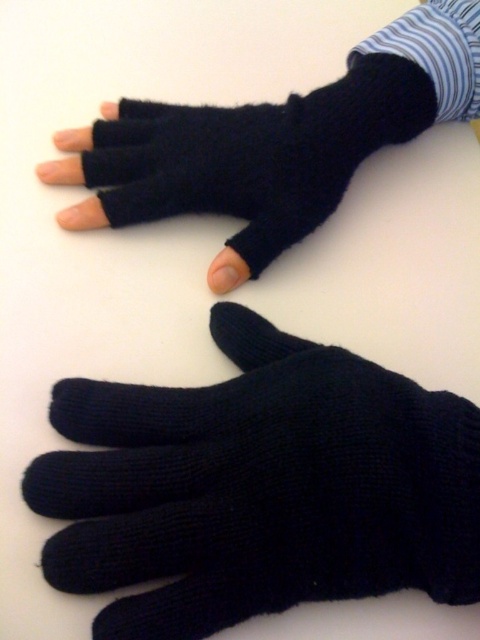
You are trying to decide which glove to wear for a cold day. Both the black knitted glove at center and the black knitted fingerless glove at upper center are available. Which one would provide more hand coverage?

The black knitted glove at center is much taller than the black knitted fingerless glove at upper center, so it provides more hand coverage.

You are a delivery robot that needs to place a package between the black knitted glove at center and the black knitted fingerless glove at upper center. The package requires at least 15 inches of space to be placed safely. Can you fit the package between them?

The black knitted glove at center and black knitted fingerless glove at upper center are 14.49 inches apart, which is less than the required 15 inches. Therefore, the package cannot be safely placed between them.